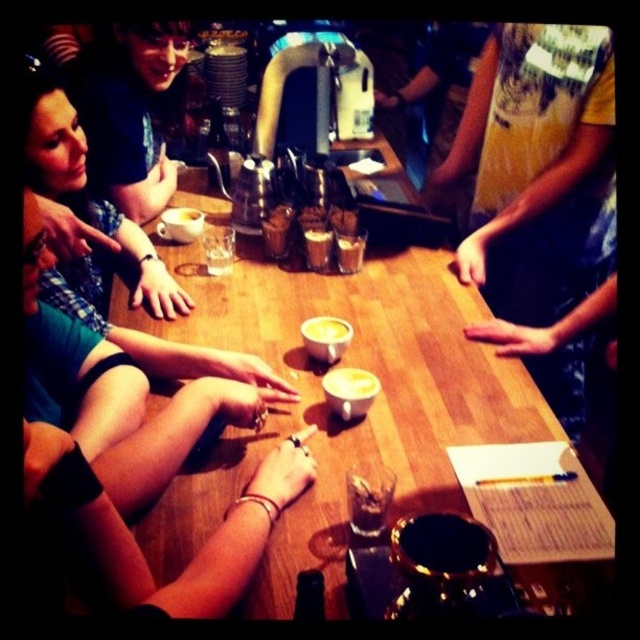
Question: Can you confirm if blue denim shirt at right is smaller than white matte cup at center?

Choices:
 (A) yes
 (B) no

Answer: (B)

Question: Which of the following is the closest to the observer?

Choices:
 (A) (189, 225)
 (B) (314, 248)
 (C) (342, 269)
 (D) (355, 368)

Answer: (D)

Question: Which point appears farthest from the camera in this image?

Choices:
 (A) (134, 230)
 (B) (330, 346)
 (C) (188, 225)
 (D) (336, 244)

Answer: (C)

Question: Is yellow frothy beverage at center smaller than white matte cup at center?

Choices:
 (A) yes
 (B) no

Answer: (A)

Question: Which point is closer to the camera taking this photo?

Choices:
 (A) (339, 403)
 (B) (358, 260)
 (C) (189, 241)
 (D) (273, 490)

Answer: (D)

Question: Can you confirm if white frothy latte at center is positioned to the left of translucent glass at center?

Choices:
 (A) no
 (B) yes

Answer: (B)